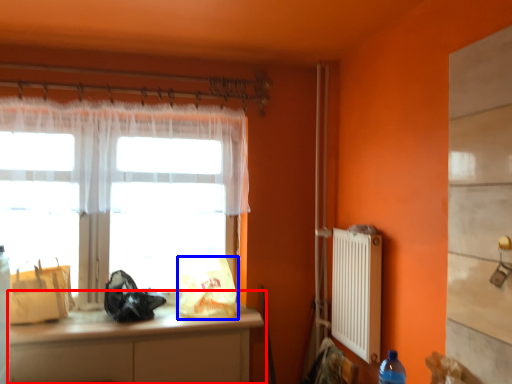
Question: Which point is further to the camera, cabinetry (highlighted by a red box) or bag (highlighted by a blue box)?

Choices:
 (A) cabinetry
 (B) bag

Answer: (B)